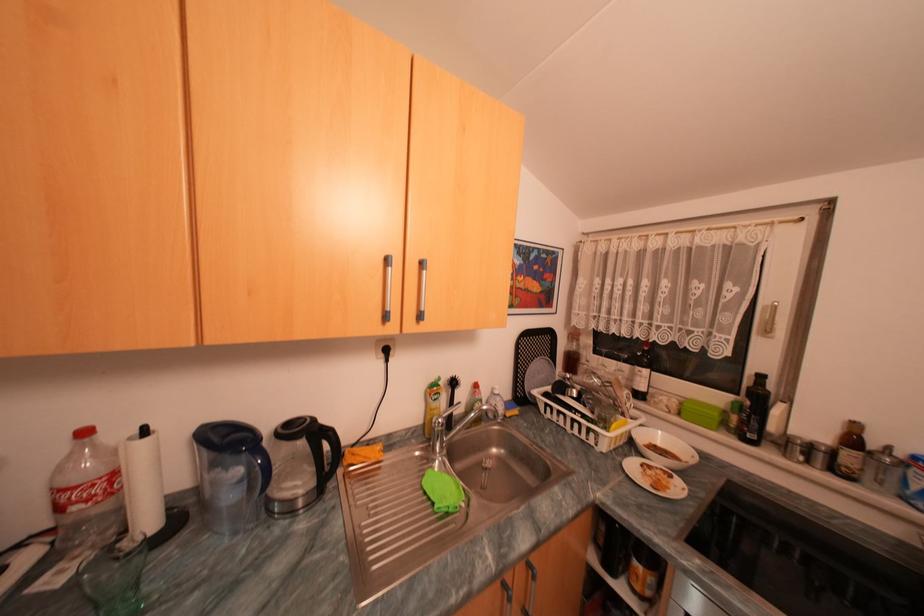
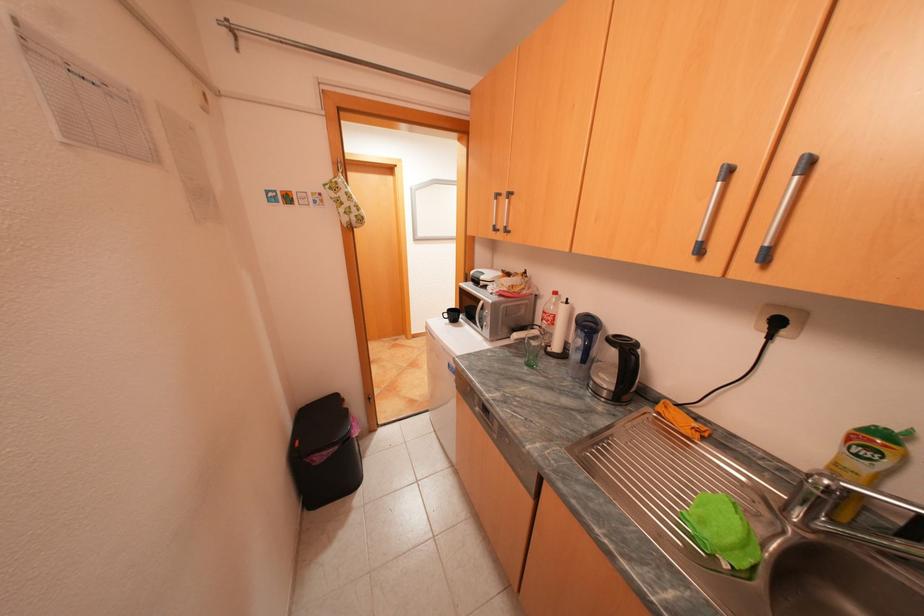
Find the pixel in the second image that matches point (73, 488) in the first image.

(553, 312)